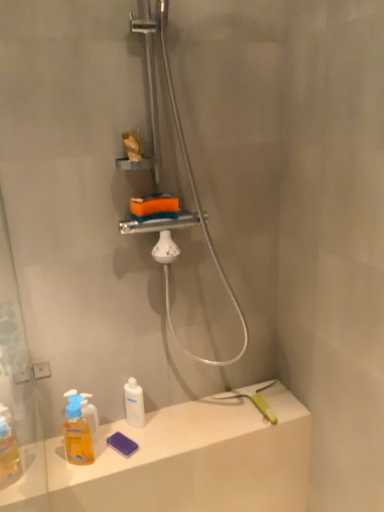
Question: Could you tell me if white glossy bottle at lower center, the first mouthwash from the right, is facing matte white counter top at lower left?

Choices:
 (A) no
 (B) yes

Answer: (A)

Question: From a real-world perspective, is white glossy bottle at lower center, which is counted as the second mouthwash, starting from the front, physically above matte white counter top at lower left?

Choices:
 (A) yes
 (B) no

Answer: (A)

Question: Is white glossy bottle at lower center, the first mouthwash from the right, far from matte white counter top at lower left?

Choices:
 (A) yes
 (B) no

Answer: (B)

Question: From the image's perspective, is white glossy bottle at lower center, which is counted as the second mouthwash, starting from the front, above matte white counter top at lower left?

Choices:
 (A) yes
 (B) no

Answer: (A)

Question: Would you say white glossy bottle at lower center, which is counted as the second mouthwash, starting from the left, is outside matte white counter top at lower left?

Choices:
 (A) no
 (B) yes

Answer: (B)

Question: Is white glossy bottle at lower center, the first mouthwash from the right, smaller than matte white counter top at lower left?

Choices:
 (A) no
 (B) yes

Answer: (B)

Question: Is metallic silver shower at upper center taller than translucent plastic mouthwash at lower left, which appears as the first mouthwash when viewed from the front?

Choices:
 (A) no
 (B) yes

Answer: (B)

Question: Is metallic silver shower at upper center not within translucent plastic mouthwash at lower left, positioned as the 1th mouthwash in left-to-right order?

Choices:
 (A) yes
 (B) no

Answer: (A)

Question: Is metallic silver shower at upper center shorter than translucent plastic mouthwash at lower left, arranged as the 2th mouthwash when viewed from the back?

Choices:
 (A) yes
 (B) no

Answer: (B)

Question: From a real-world perspective, does metallic silver shower at upper center sit lower than translucent plastic mouthwash at lower left, which appears as the first mouthwash when viewed from the front?

Choices:
 (A) no
 (B) yes

Answer: (A)

Question: Does metallic silver shower at upper center have a smaller size compared to translucent plastic mouthwash at lower left, which is the second mouthwash from right to left?

Choices:
 (A) yes
 (B) no

Answer: (B)

Question: Considering the relative sizes of metallic silver shower at upper center and translucent plastic mouthwash at lower left, positioned as the 1th mouthwash in left-to-right order, in the image provided, is metallic silver shower at upper center wider than translucent plastic mouthwash at lower left, positioned as the 1th mouthwash in left-to-right order,?

Choices:
 (A) yes
 (B) no

Answer: (A)

Question: Considering the relative sizes of translucent plastic mouthwash at lower left, arranged as the 2th mouthwash when viewed from the back, and white glossy bottle at lower center, which is counted as the second mouthwash, starting from the front, in the image provided, is translucent plastic mouthwash at lower left, arranged as the 2th mouthwash when viewed from the back, bigger than white glossy bottle at lower center, which is counted as the second mouthwash, starting from the front,?

Choices:
 (A) no
 (B) yes

Answer: (B)